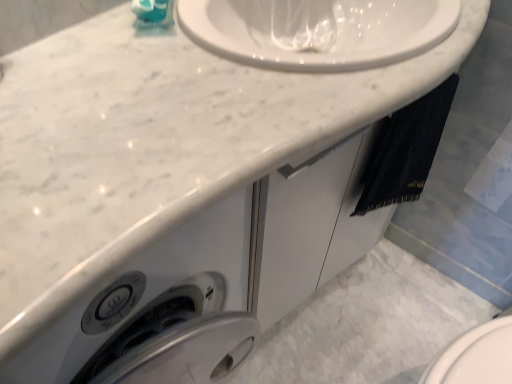
Find the location of a particular element. The width and height of the screenshot is (512, 384). free space in front of teal glossy soap dispenser at upper left is located at coordinates (135, 74).